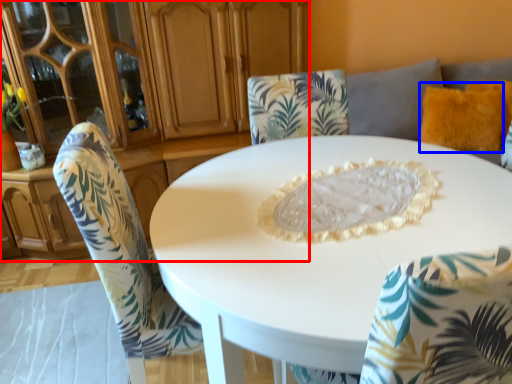
Question: Which point is further to the camera, dresser (highlighted by a red box) or pillow (highlighted by a blue box)?

Choices:
 (A) dresser
 (B) pillow

Answer: (B)